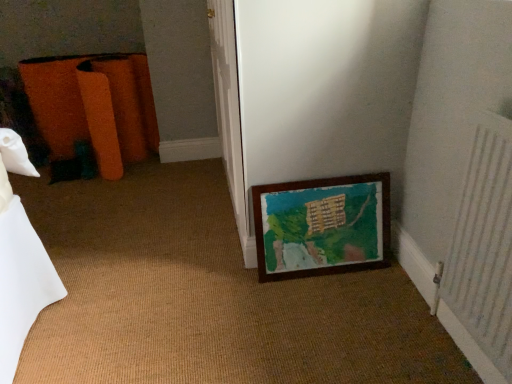
Where is `vacant space to the left of wooden frame at lower right`? Image resolution: width=512 pixels, height=384 pixels. vacant space to the left of wooden frame at lower right is located at coordinates (232, 278).